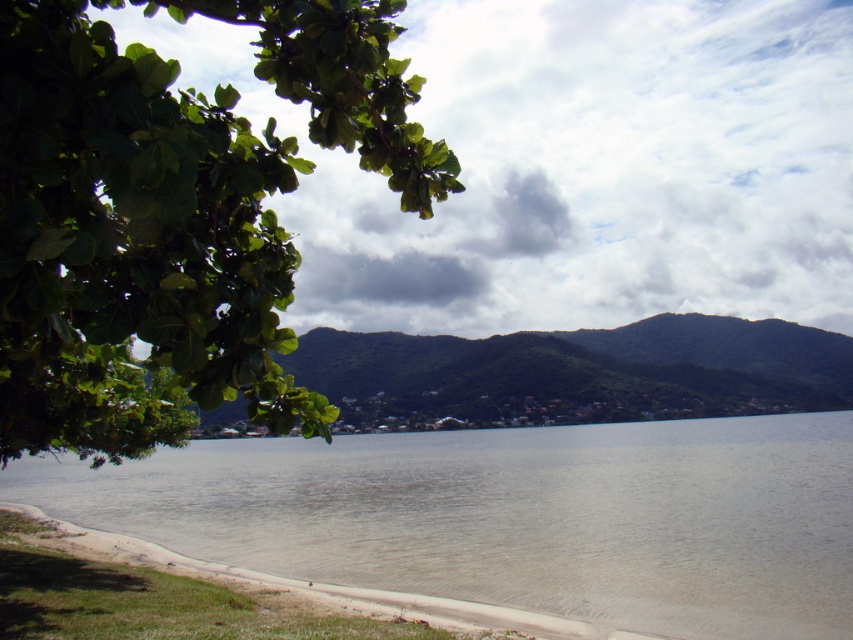
Who is higher up, green leafy branch at upper left or green leafy hill at center?

green leafy branch at upper left is above.

Where is `green leafy branch at upper left`? The height and width of the screenshot is (640, 853). green leafy branch at upper left is located at coordinates (132, 244).

Where is `green leafy branch at upper left`? This screenshot has width=853, height=640. green leafy branch at upper left is located at coordinates (132, 244).

Is clear water at lower center behind green leafy hill at center?

Yes, clear water at lower center is behind green leafy hill at center.

Can you confirm if clear water at lower center is smaller than green leafy hill at center?

Indeed, clear water at lower center has a smaller size compared to green leafy hill at center.

What do you see at coordinates (514, 516) in the screenshot?
I see `clear water at lower center` at bounding box center [514, 516].

The image size is (853, 640). I want to click on clear water at lower center, so click(514, 516).

Is green leafy branch at upper left to the right of clear water at lower center from the viewer's perspective?

No, green leafy branch at upper left is not to the right of clear water at lower center.

Which is in front, point (181, 262) or point (140, 516)?

Point (181, 262) is more forward.

Describe the element at coordinates (132, 244) in the screenshot. I see `green leafy branch at upper left` at that location.

Where is `green leafy branch at upper left`? This screenshot has height=640, width=853. green leafy branch at upper left is located at coordinates coord(132,244).